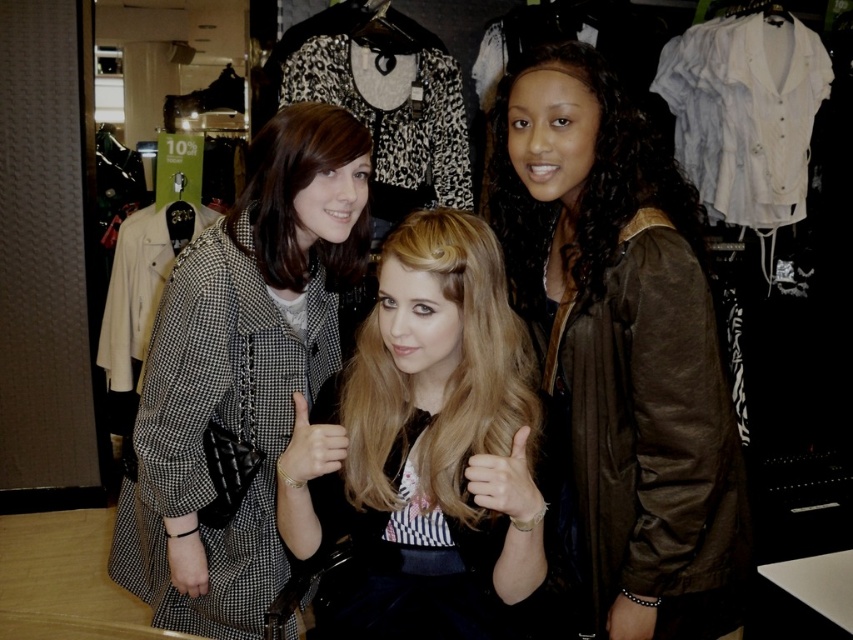
This screenshot has height=640, width=853. In order to click on brown leather jacket at right in this screenshot , I will do `click(619, 348)`.

Does brown leather jacket at right come in front of black leather bracelet at lower right?

Yes.

Where is `brown leather jacket at right`? brown leather jacket at right is located at coordinates tap(619, 348).

Is brown leather jacket at right above smooth skin hand at center?

Yes.

Where is `brown leather jacket at right`? This screenshot has height=640, width=853. brown leather jacket at right is located at coordinates pyautogui.click(x=619, y=348).

At what (x,y) coordinates should I click in order to perform the action: click on brown leather jacket at right. Please return your answer as a coordinate pair (x, y). Looking at the image, I should click on (619, 348).

Based on the photo, which is below, brown leather jacket at right or checkered fabric coat at center?

Positioned lower is checkered fabric coat at center.

How much distance is there between brown leather jacket at right and checkered fabric coat at center?

brown leather jacket at right and checkered fabric coat at center are 21.82 inches apart from each other.

Is point (672, 576) more distant than point (169, 328)?

No, (672, 576) is in front of (169, 328).

Identify the location of brown leather jacket at right. Image resolution: width=853 pixels, height=640 pixels. (619, 348).